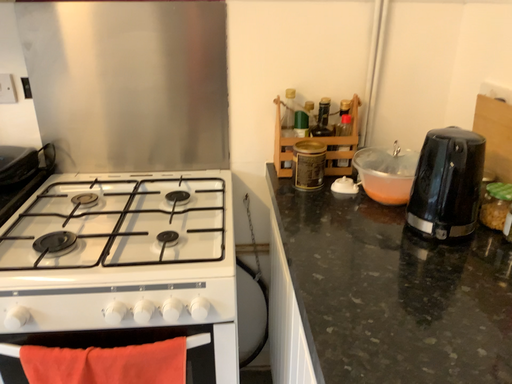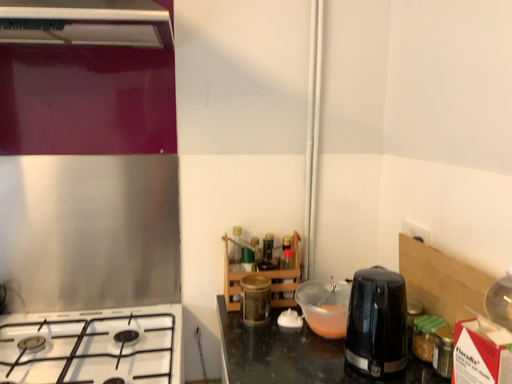
Question: Which way did the camera rotate in the video?

Choices:
 (A) rotated upward
 (B) rotated downward

Answer: (A)